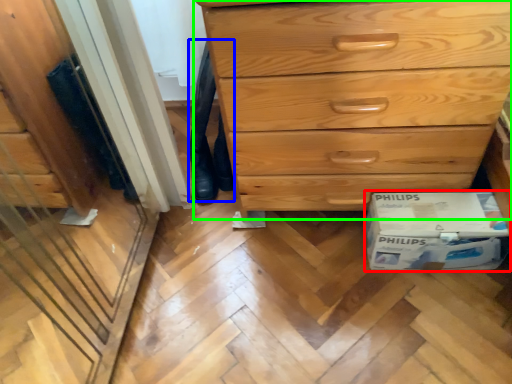
Question: Which is nearer to the cardboard box (highlighted by a red box)? jeans (highlighted by a blue box) or chest of drawers (highlighted by a green box).

Choices:
 (A) jeans
 (B) chest of drawers

Answer: (B)